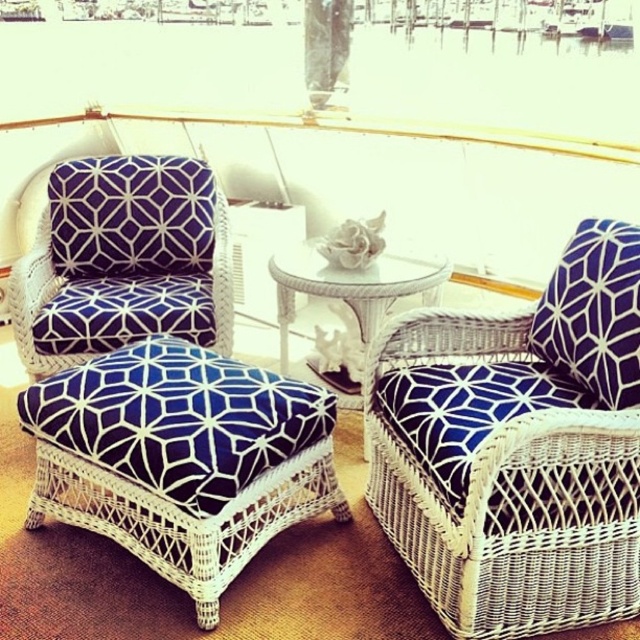
Question: Is blue printed cushion at right positioned before glassy white table at center?

Choices:
 (A) no
 (B) yes

Answer: (B)

Question: Which point is farther to the camera?

Choices:
 (A) white wicker armchair at center
 (B) blue printed cushion at right

Answer: (B)

Question: Among these points, which one is farthest from the camera?

Choices:
 (A) (92, 506)
 (B) (138, 200)
 (C) (371, 330)

Answer: (B)

Question: Is white wicker armchair at center behind blue printed cushion at right?

Choices:
 (A) yes
 (B) no

Answer: (B)

Question: Does white wicker armchair at center have a lesser width compared to navy blue fabric stool at center?

Choices:
 (A) yes
 (B) no

Answer: (A)

Question: Which point is closer to the camera?

Choices:
 (A) glassy white table at center
 (B) matte blue fabric armchair at left

Answer: (A)